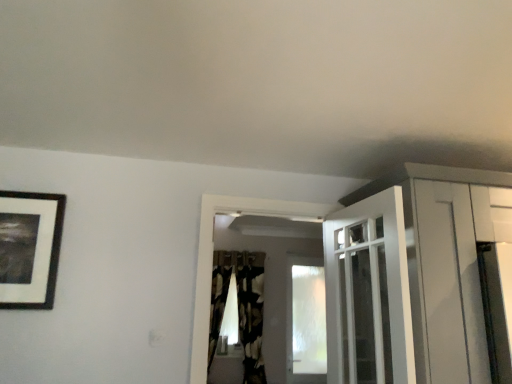
Question: Is black matte picture frame at upper left completely or partially outside of transparent frosted glass window at center?

Choices:
 (A) yes
 (B) no

Answer: (A)

Question: Are black matte picture frame at upper left and transparent frosted glass window at center far apart?

Choices:
 (A) no
 (B) yes

Answer: (B)

Question: From a real-world perspective, is black matte picture frame at upper left below transparent frosted glass window at center?

Choices:
 (A) no
 (B) yes

Answer: (A)

Question: Does black matte picture frame at upper left turn towards transparent frosted glass window at center?

Choices:
 (A) no
 (B) yes

Answer: (A)

Question: Is black matte picture frame at upper left at the right side of transparent frosted glass window at center?

Choices:
 (A) no
 (B) yes

Answer: (A)

Question: Is black matte picture frame at upper left bigger than transparent frosted glass window at center?

Choices:
 (A) yes
 (B) no

Answer: (B)

Question: Does transparent frosted glass window at center come behind white glossy door at upper center?

Choices:
 (A) no
 (B) yes

Answer: (B)

Question: Does transparent frosted glass window at center touch white glossy door at upper center?

Choices:
 (A) yes
 (B) no

Answer: (B)

Question: Is transparent frosted glass window at center oriented towards white glossy door at upper center?

Choices:
 (A) no
 (B) yes

Answer: (B)

Question: Does transparent frosted glass window at center have a larger size compared to white glossy door at upper center?

Choices:
 (A) no
 (B) yes

Answer: (A)

Question: Is transparent frosted glass window at center oriented away from white glossy door at upper center?

Choices:
 (A) no
 (B) yes

Answer: (A)

Question: Is transparent frosted glass window at center to the right of white glossy door at upper center from the viewer's perspective?

Choices:
 (A) no
 (B) yes

Answer: (B)

Question: Is the depth of black textured curtain at center greater than that of black matte picture frame at upper left?

Choices:
 (A) no
 (B) yes

Answer: (B)